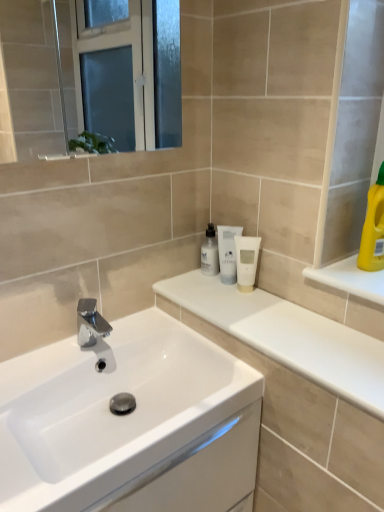
Question: Can you confirm if white glossy sink at center is taller than white matte tube at center, positioned as the third mouthwash in left-to-right order?

Choices:
 (A) no
 (B) yes

Answer: (A)

Question: Is white glossy sink at center shorter than white matte tube at center, positioned as the third mouthwash in left-to-right order?

Choices:
 (A) yes
 (B) no

Answer: (A)

Question: Is white matte tube at center, positioned as the third mouthwash in left-to-right order, at the back of white glossy sink at center?

Choices:
 (A) yes
 (B) no

Answer: (B)

Question: Is white glossy sink at center bigger than white matte tube at center, positioned as the third mouthwash in left-to-right order?

Choices:
 (A) yes
 (B) no

Answer: (A)

Question: Does white glossy sink at center have a lesser width compared to white matte tube at center, positioned as the third mouthwash in left-to-right order?

Choices:
 (A) yes
 (B) no

Answer: (B)

Question: Is white glossy bottle at center, which is the first mouthwash from left to right, taller or shorter than white glossy sink at center?

Choices:
 (A) tall
 (B) short

Answer: (A)

Question: From the image's perspective, relative to white glossy sink at center, is white glossy bottle at center, the 3th mouthwash positioned from the right, above or below?

Choices:
 (A) above
 (B) below

Answer: (A)

Question: Does point (215, 245) appear closer or farther from the camera than point (180, 466)?

Choices:
 (A) closer
 (B) farther

Answer: (B)

Question: Is white glossy bottle at center, which is the first mouthwash from left to right, in front of or behind white glossy sink at center in the image?

Choices:
 (A) behind
 (B) front

Answer: (A)

Question: Considering their positions, is yellow plastic bottle at upper right located in front of or behind white glossy counter at center?

Choices:
 (A) front
 (B) behind

Answer: (B)

Question: Would you say yellow plastic bottle at upper right is to the left or to the right of white glossy counter at center in the picture?

Choices:
 (A) left
 (B) right

Answer: (B)

Question: Does point (375, 203) appear closer or farther from the camera than point (362, 334)?

Choices:
 (A) closer
 (B) farther

Answer: (B)

Question: Is yellow plastic bottle at upper right wider or thinner than white glossy counter at center?

Choices:
 (A) thin
 (B) wide

Answer: (A)

Question: Does point coord(205,249) appear closer or farther from the camera than point coord(294,384)?

Choices:
 (A) farther
 (B) closer

Answer: (A)

Question: Is white glossy bottle at center, the 3th mouthwash positioned from the right, in front of or behind white glossy counter at center in the image?

Choices:
 (A) front
 (B) behind

Answer: (B)